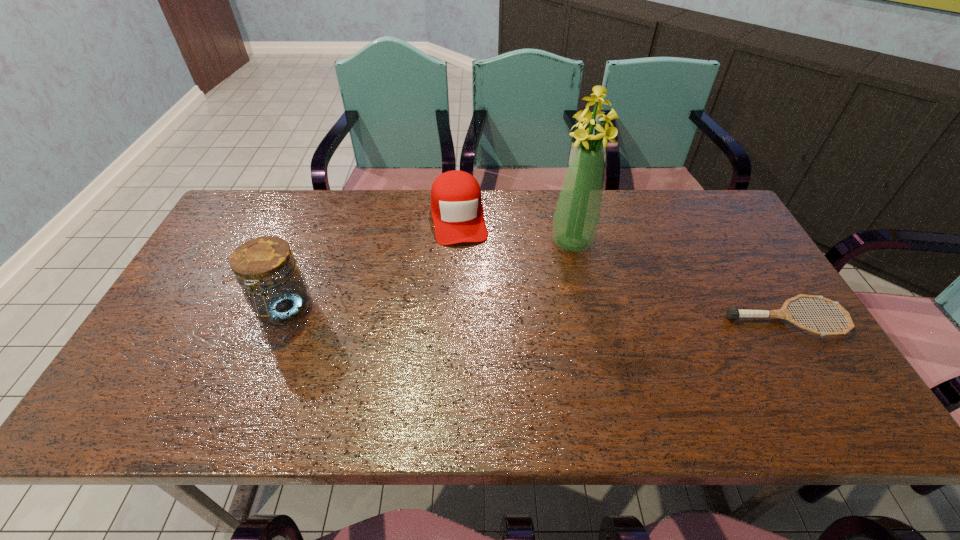
The width and height of the screenshot is (960, 540). Identify the location of the second tallest object. (274, 287).

You are a GUI agent. You are given a task and a screenshot of the screen. Output one action in this format:
    pyautogui.click(x=<x>, y=<y>)
    Task: Click on the jar
    Image resolution: width=960 pixels, height=540 pixels.
    Given the screenshot: What is the action you would take?
    pyautogui.click(x=274, y=287)

Identify the location of the shortest object. The image size is (960, 540). (733, 313).

Locate an element on the screen. the rightmost object is located at coordinates (733, 313).

Find the location of a particular element. The width and height of the screenshot is (960, 540). bouquet is located at coordinates [576, 218].

Locate an element on the screen. the second object from right to left is located at coordinates (576, 218).

This screenshot has height=540, width=960. Find the location of `baseball cap`. baseball cap is located at coordinates (456, 206).

You are a GUI agent. You are given a task and a screenshot of the screen. Output one action in this format:
    pyautogui.click(x=<x>, y=<y>)
    Task: Click on the third tallest object
    This screenshot has height=540, width=960.
    Given the screenshot: What is the action you would take?
    pyautogui.click(x=456, y=206)

Identify the location of blank space located on the lid of the jar. The image size is (960, 540). (260, 370).

You are a GUI agent. You are given a task and a screenshot of the screen. Output one action in this format:
    pyautogui.click(x=<x>, y=<y>)
    Task: Click on the free space located 0.110m on the back of the shortest object
    The image size is (960, 540).
    Given the screenshot: What is the action you would take?
    756,269